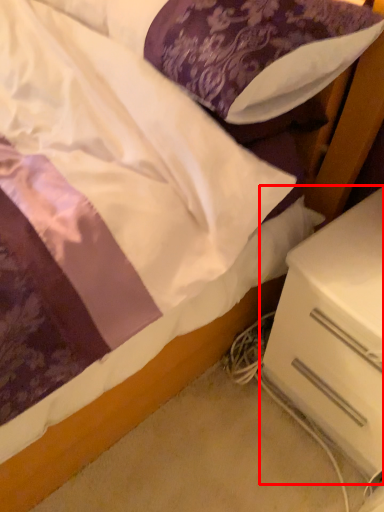
Question: From the image's perspective, what is the correct spatial relationship of nightstand (annotated by the red box) in relation to pillow?

Choices:
 (A) above
 (B) below

Answer: (B)